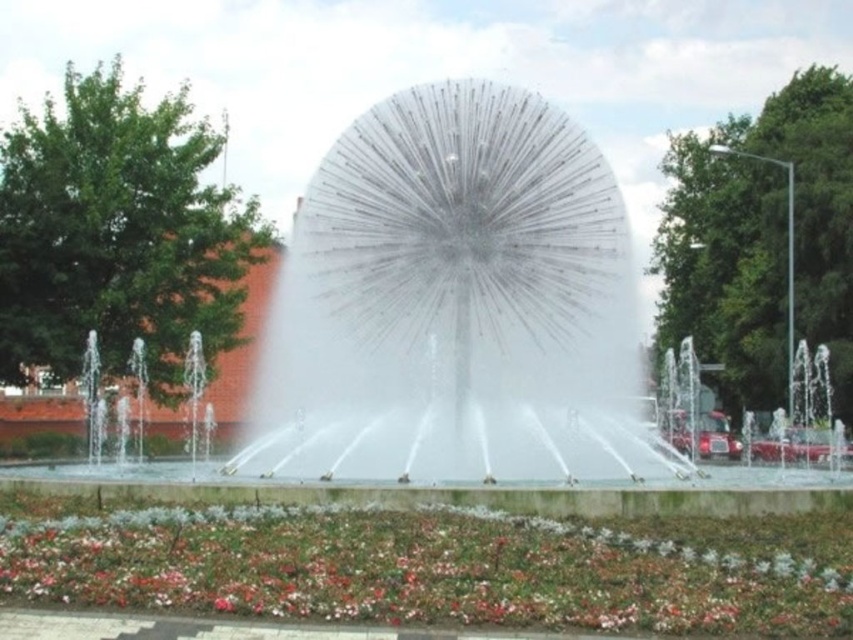
Can you confirm if transparent glass sphere at center is positioned to the left of multicolored fabric flower at lower center?

Yes, transparent glass sphere at center is to the left of multicolored fabric flower at lower center.

Is the position of transparent glass sphere at center less distant than that of multicolored fabric flower at lower center?

No.

Is point (430, 490) less distant than point (498, 593)?

No, it is behind (498, 593).

At what (x,y) coordinates should I click in order to perform the action: click on transparent glass sphere at center. Please return your answer as a coordinate pair (x, y). This screenshot has width=853, height=640. Looking at the image, I should click on (457, 326).